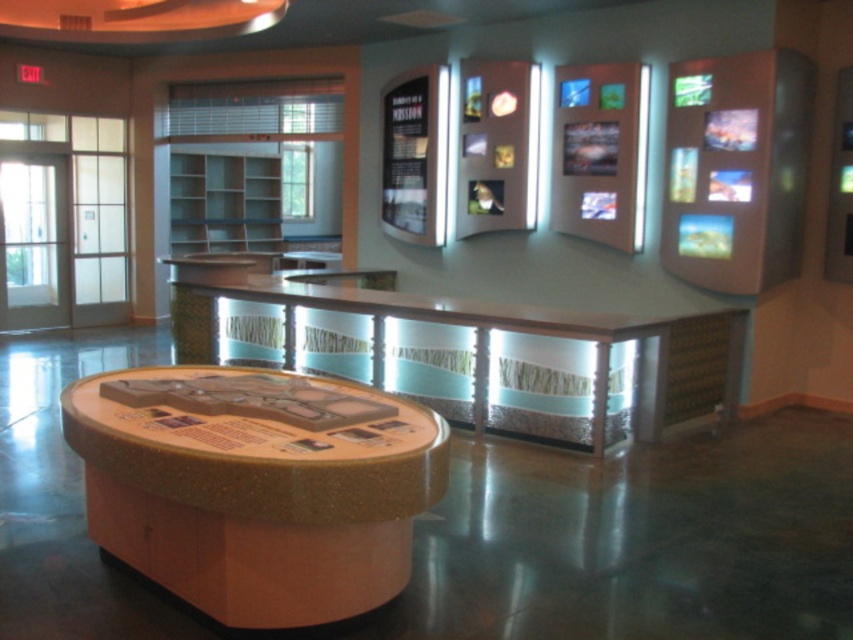
Locate an element on the screen. This screenshot has height=640, width=853. wooden textured table at center is located at coordinates (256, 486).

Is wooden textured table at center positioned behind smooth polished wood table at center?

No, it is not.

The image size is (853, 640). Describe the element at coordinates (256, 486) in the screenshot. I see `wooden textured table at center` at that location.

Find the location of a particular element. wooden textured table at center is located at coordinates (256, 486).